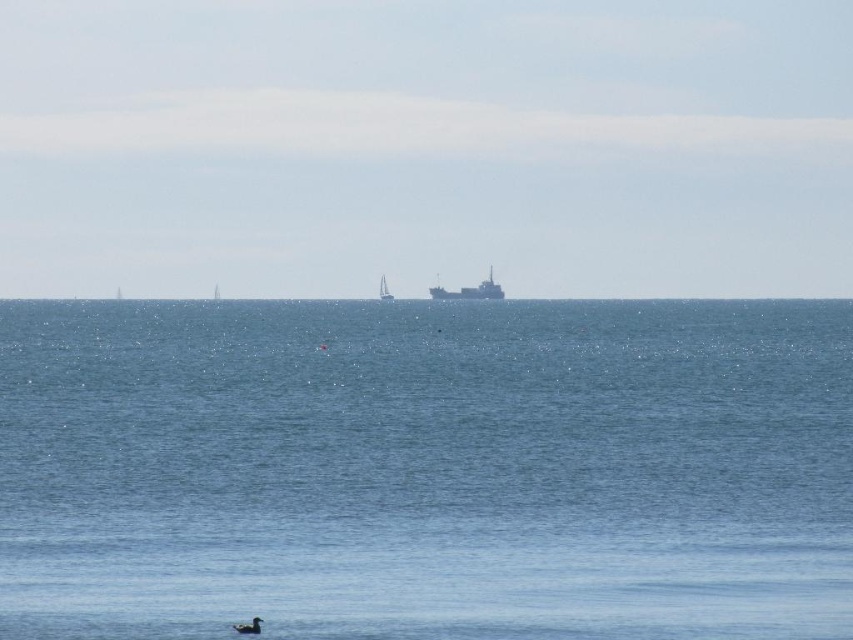
Does metallic gray ship at center have a smaller size compared to white plastic sailboat at center?

Actually, metallic gray ship at center might be larger than white plastic sailboat at center.

Does metallic gray ship at center have a lesser height compared to white plastic sailboat at center?

No.

Where is `metallic gray ship at center`? This screenshot has height=640, width=853. metallic gray ship at center is located at coordinates (469, 291).

Locate an element on the screen. The height and width of the screenshot is (640, 853). metallic gray ship at center is located at coordinates (469, 291).

Who is positioned more to the right, blue water at center or white plastic sailboat at center?

Positioned to the right is blue water at center.

Does blue water at center appear under white plastic sailboat at center?

Yes.

Between point (691, 440) and point (379, 291), which one is positioned in front?

Point (691, 440) is in front.

Locate an element on the screen. The width and height of the screenshot is (853, 640). blue water at center is located at coordinates (426, 470).

Who is positioned more to the right, blue water at center or metallic gray ship at center?

metallic gray ship at center

Which is in front, point (679, 621) or point (485, 294)?

Point (679, 621)

Where is `blue water at center`? This screenshot has height=640, width=853. blue water at center is located at coordinates (426, 470).